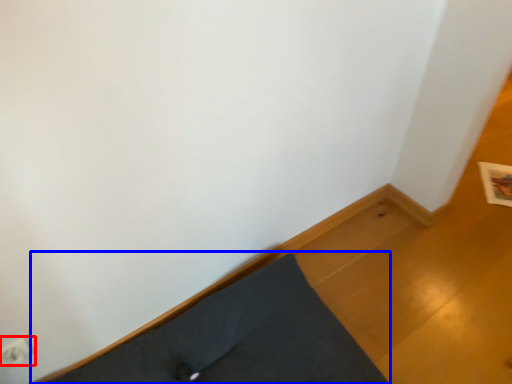
Question: Which object appears closest to the camera in this image, electric outlet (highlighted by a red box) or bed frame (highlighted by a blue box)?

Choices:
 (A) electric outlet
 (B) bed frame

Answer: (B)